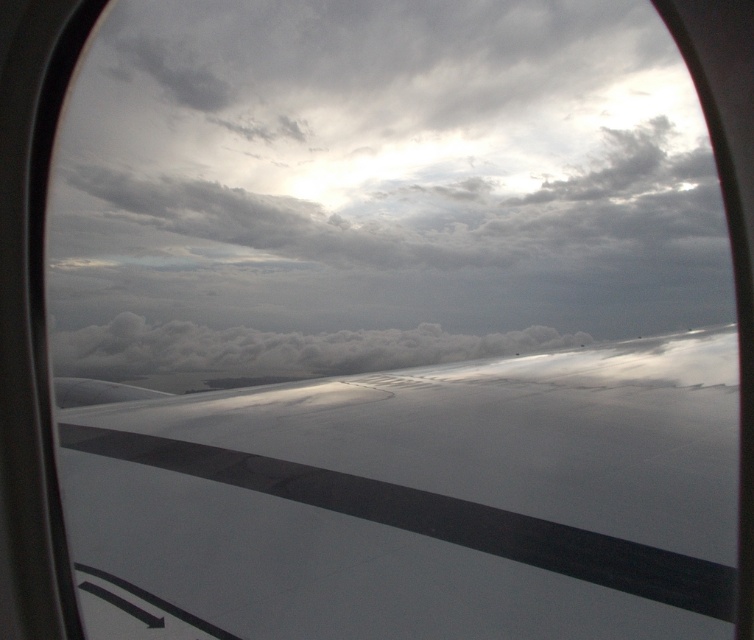
Does white glossy wing at center have a greater height compared to white fluffy cloud at center?

Incorrect, white glossy wing at center's height is not larger of white fluffy cloud at center's.

Is white glossy wing at center smaller than white fluffy cloud at center?

Indeed, white glossy wing at center has a smaller size compared to white fluffy cloud at center.

Identify the location of white glossy wing at center. The height and width of the screenshot is (640, 754). (418, 500).